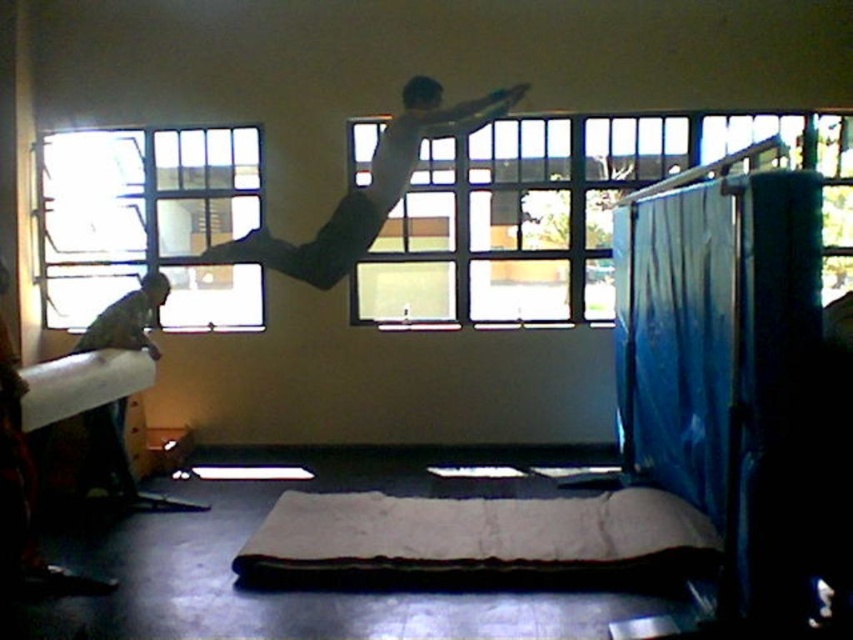
Question: Which of these objects is positioned farthest from the clear glass window at upper center?

Choices:
 (A) clear glass window at upper left
 (B) gray fabric mat at center
 (C) white matte shirt at upper center
 (D) white cardboard at left

Answer: (D)

Question: Which point is closer to the camera taking this photo?

Choices:
 (A) (526, 196)
 (B) (49, 307)
 (C) (341, 234)

Answer: (C)

Question: Estimate the real-world distances between objects in this image. Which object is closer to the gray fabric mat at center?

Choices:
 (A) clear glass window at upper center
 (B) clear glass window at upper left
 (C) white matte shirt at upper center
 (D) white cardboard at left

Answer: (D)

Question: Does clear glass window at upper center come in front of gray fabric mat at center?

Choices:
 (A) yes
 (B) no

Answer: (B)

Question: Is gray fabric mat at center bigger than white cardboard at left?

Choices:
 (A) yes
 (B) no

Answer: (A)

Question: Is clear glass window at upper center below gray fabric mat at center?

Choices:
 (A) no
 (B) yes

Answer: (A)